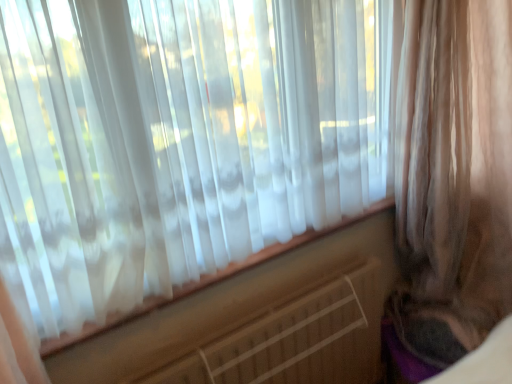
Question: Does sheer beige curtain at right have a lesser height compared to white plastic radiator at center?

Choices:
 (A) yes
 (B) no

Answer: (B)

Question: Is the surface of sheer beige curtain at right in direct contact with white plastic radiator at center?

Choices:
 (A) no
 (B) yes

Answer: (A)

Question: From a real-world perspective, is sheer beige curtain at right positioned under white plastic radiator at center based on gravity?

Choices:
 (A) no
 (B) yes

Answer: (A)

Question: Is sheer beige curtain at right positioned with its back to white plastic radiator at center?

Choices:
 (A) yes
 (B) no

Answer: (B)

Question: Does sheer beige curtain at right lie behind white plastic radiator at center?

Choices:
 (A) no
 (B) yes

Answer: (A)

Question: Can you confirm if sheer beige curtain at right is positioned to the right of white plastic radiator at center?

Choices:
 (A) no
 (B) yes

Answer: (B)

Question: Does white plastic radiator at center have a lesser height compared to sheer beige curtain at right?

Choices:
 (A) no
 (B) yes

Answer: (B)

Question: From a real-world perspective, is white plastic radiator at center physically below sheer beige curtain at right?

Choices:
 (A) no
 (B) yes

Answer: (B)

Question: Can you confirm if white plastic radiator at center is thinner than sheer beige curtain at right?

Choices:
 (A) yes
 (B) no

Answer: (A)

Question: Is white plastic radiator at center in front of sheer beige curtain at right?

Choices:
 (A) no
 (B) yes

Answer: (A)

Question: Is white plastic radiator at center outside sheer beige curtain at right?

Choices:
 (A) no
 (B) yes

Answer: (B)

Question: Is white plastic radiator at center oriented away from sheer beige curtain at right?

Choices:
 (A) yes
 (B) no

Answer: (B)

Question: Looking at the image, does sheer beige curtain at right seem bigger or smaller compared to white plastic radiator at center?

Choices:
 (A) small
 (B) big

Answer: (B)